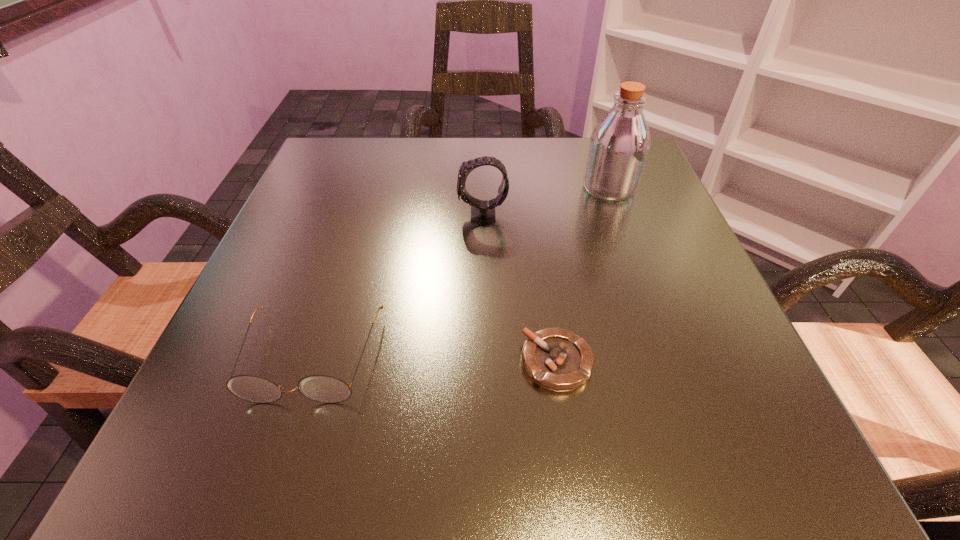
Identify the location of unoccupied area between the third shortest object and the ashtray. The image size is (960, 540). 519,288.

The width and height of the screenshot is (960, 540). In order to click on object that can be found as the closest to the watch in this screenshot , I will do `click(619, 145)`.

The image size is (960, 540). In order to click on object that is the closest to the third tallest object in this screenshot , I will do `click(556, 359)`.

Identify the location of free space in the image that satisfies the following two spatial constraints: 1. on the face of the watch; 2. on the temples of the leftmost object. The height and width of the screenshot is (540, 960). (483, 358).

You are a GUI agent. You are given a task and a screenshot of the screen. Output one action in this format:
    pyautogui.click(x=<x>, y=<y>)
    Task: Click on the free space that satisfies the following two spatial constraints: 1. on the front side of the farthest object; 2. on the face of the watch
    
    Given the screenshot: What is the action you would take?
    pyautogui.click(x=619, y=215)

Identify the location of free space that satisfies the following two spatial constraints: 1. on the front side of the farthest object; 2. on the face of the third shortest object. The width and height of the screenshot is (960, 540). (619, 215).

Where is `vacant space that satisfies the following two spatial constraints: 1. on the temples of the shortest object; 2. on the left side of the leftmost object`? The image size is (960, 540). vacant space that satisfies the following two spatial constraints: 1. on the temples of the shortest object; 2. on the left side of the leftmost object is located at coordinates (311, 362).

Identify the location of free spot that satisfies the following two spatial constraints: 1. on the face of the watch; 2. on the back side of the ashtray. (484, 362).

At what (x,y) coordinates should I click in order to perform the action: click on free location that satisfies the following two spatial constraints: 1. on the temples of the leftmost object; 2. on the right side of the second object from right to left. Please return your answer as a coordinate pair (x, y). This screenshot has height=540, width=960. Looking at the image, I should click on (311, 362).

Find the location of a particular element. The width and height of the screenshot is (960, 540). free region that satisfies the following two spatial constraints: 1. on the face of the watch; 2. on the right side of the ashtray is located at coordinates (484, 362).